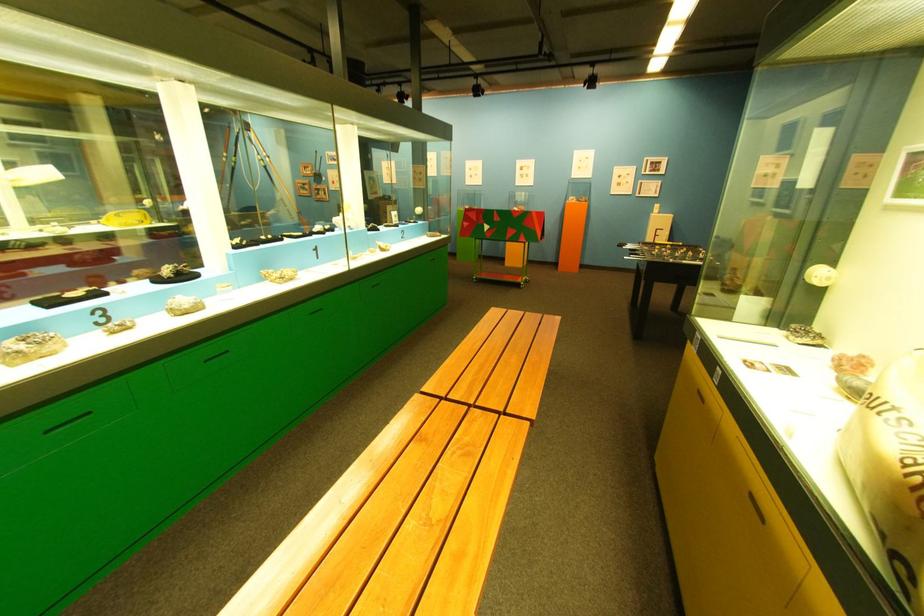
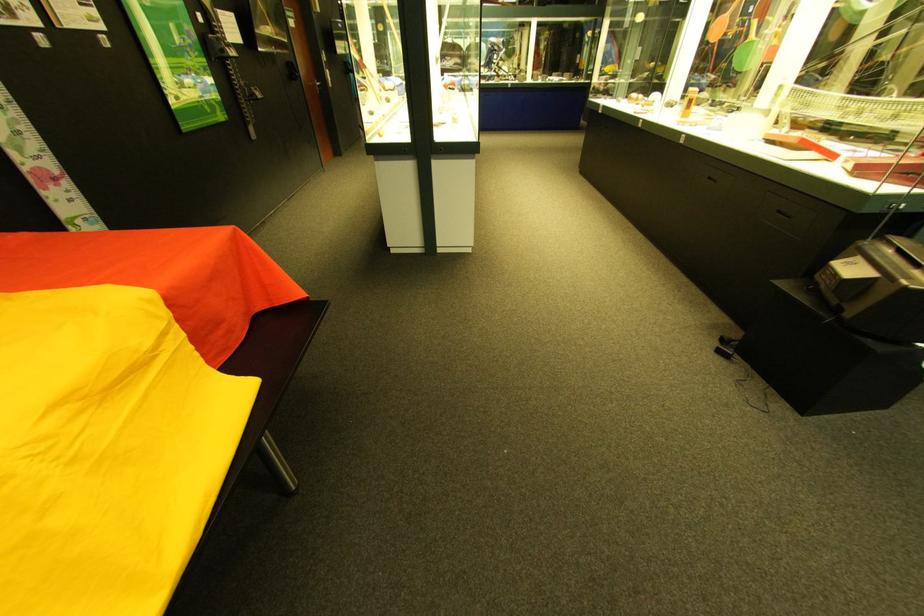
Question: I am providing you with two images of the same scene from different viewpoints. Which of the following objects are not visible in image2?

Choices:
 (A) silver door handle
 (B) white watering can
 (C) black drawer pull
 (D) colorful wheeled cart

Answer: (D)